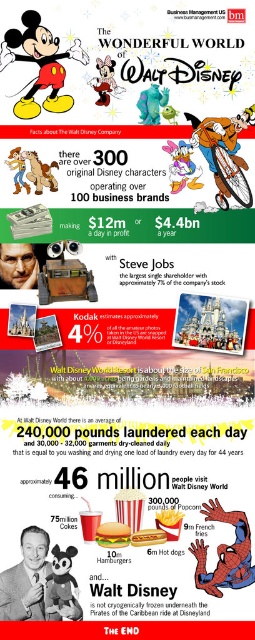
Question: Is matte red shorts at center to the right of pastel pink paper at center from the viewer's perspective?

Choices:
 (A) no
 (B) yes

Answer: (A)

Question: Which point is farther to the camera?

Choices:
 (A) matte red shorts at center
 (B) matte black spider-man at center

Answer: (B)

Question: From the image, what is the correct spatial relationship of matte red shorts at center in relation to matte black spider-man at center?

Choices:
 (A) left
 (B) right

Answer: (A)

Question: Which point is closer to the camera?

Choices:
 (A) matte black spider-man at center
 (B) matte red shorts at center
 (C) pastel pink paper at center

Answer: (B)

Question: Which of these objects is positioned closest to the matte red shorts at center?

Choices:
 (A) matte black spider-man at center
 (B) pastel pink paper at center

Answer: (B)

Question: Does matte red shorts at center appear over pastel pink paper at center?

Choices:
 (A) no
 (B) yes

Answer: (B)